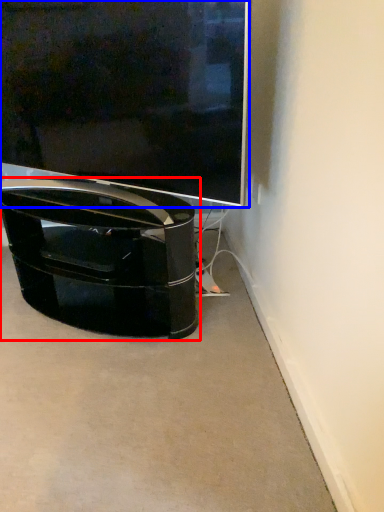
Question: Which of the following is the closest to the observer, furniture (highlighted by a red box) or television (highlighted by a blue box)?

Choices:
 (A) furniture
 (B) television

Answer: (B)